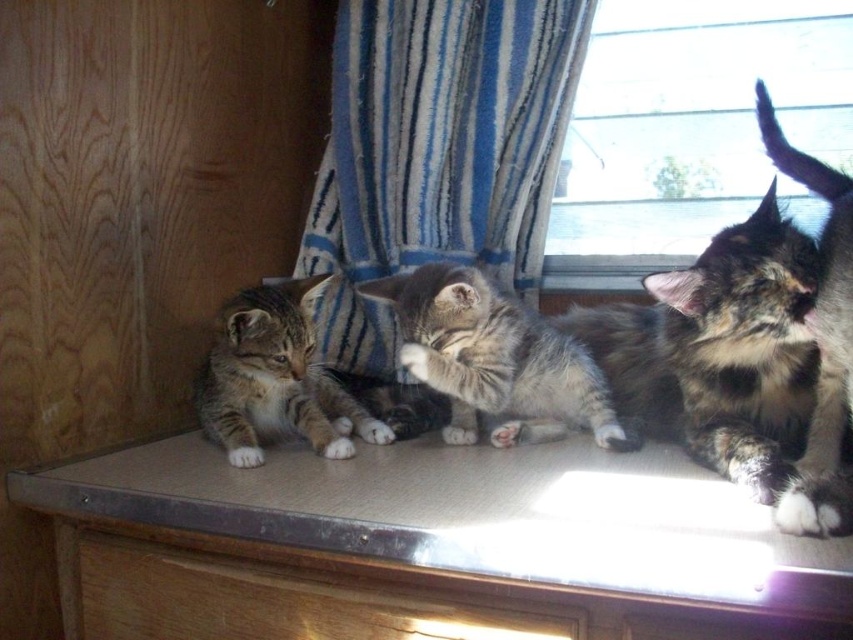
You are a photographer trying to capture a clear shot of both the calico fur cat at upper right and the wooden drawer at lower center. Since you can only focus on one subject at a time, which one should you choose to ensure the other remains in the background?

You should focus on the calico fur cat at upper right because it is closer to you than the wooden drawer at lower center, so the drawer will naturally be in the background if you focus on the cat.

You are a cat owner who wants to place a small toy at point (718, 352). Which cat will be closest to the toy?

The calico fur cat at upper right is located at point (718, 352), so placing the toy there will be closest to the calico fur cat at upper right.

You are a cat owner trying to place a new cat bed in the space where the calico fur cat at upper right and the gray tabby kitten at center are currently located. The bed requires 12 inches of space between the two cats to fit. Can you place the bed between them?

The distance between the calico fur cat at upper right and the gray tabby kitten at center is 6.96 inches, which is less than the required 12 inches. Therefore, the cat bed cannot be placed between them.